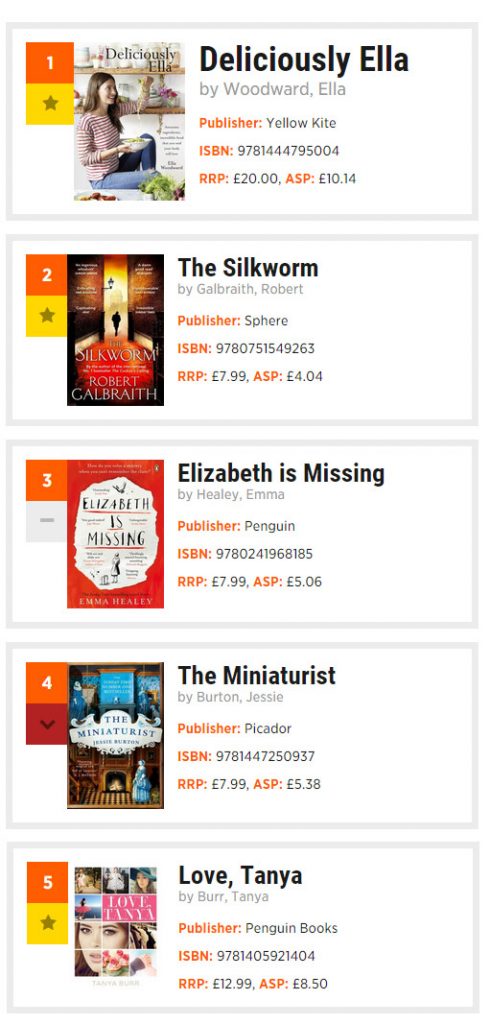
Locate an element on the screen. books in image is located at coordinates (361, 896), (361, 752), (364, 554), (370, 342), (378, 141).